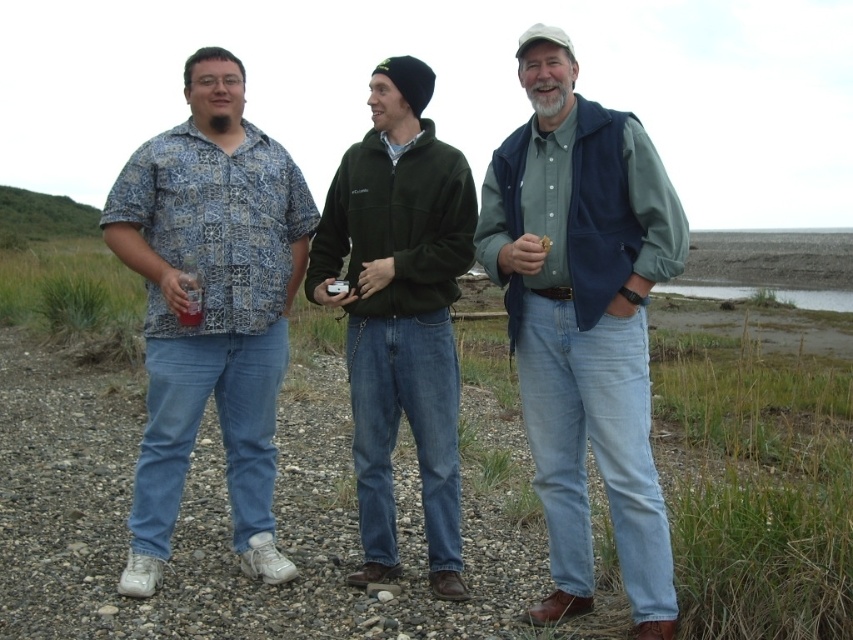
Question: Which point is farther from the camera taking this photo?

Choices:
 (A) (564, 588)
 (B) (403, 208)

Answer: (B)

Question: Is navy blue vest at center positioned in front of green fleece jacket at center?

Choices:
 (A) no
 (B) yes

Answer: (B)

Question: Which point is farther to the camera?

Choices:
 (A) (434, 349)
 (B) (508, 193)
 (C) (183, 132)

Answer: (C)

Question: Which of these objects is positioned farthest from the green fleece jacket at center?

Choices:
 (A) navy blue vest at center
 (B) patterned fabric shirt at left

Answer: (A)

Question: Is navy blue vest at center bigger than green fleece jacket at center?

Choices:
 (A) no
 (B) yes

Answer: (B)

Question: Is navy blue vest at center positioned behind green fleece jacket at center?

Choices:
 (A) yes
 (B) no

Answer: (B)